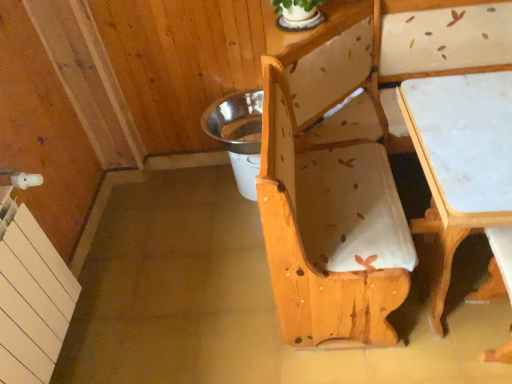
Question: Is metallic silver potty at center taller or shorter than white marble table at lower right?

Choices:
 (A) tall
 (B) short

Answer: (B)

Question: From the image's perspective, is metallic silver potty at center above or below white marble table at lower right?

Choices:
 (A) below
 (B) above

Answer: (B)

Question: Considering the real-world distances, which object is closest to the natural wood bench at center?

Choices:
 (A) metallic silver potty at center
 (B) white marble table at lower right

Answer: (B)

Question: Considering the real-world distances, which object is farthest from the white marble table at lower right?

Choices:
 (A) metallic silver potty at center
 (B) natural wood bench at center

Answer: (A)